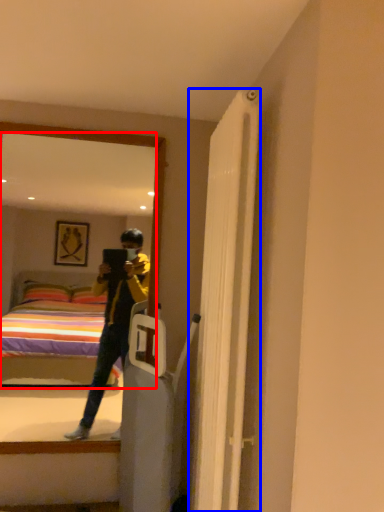
Question: Which object is closer to the camera taking this photo, mirror (highlighted by a red box) or door (highlighted by a blue box)?

Choices:
 (A) mirror
 (B) door

Answer: (B)